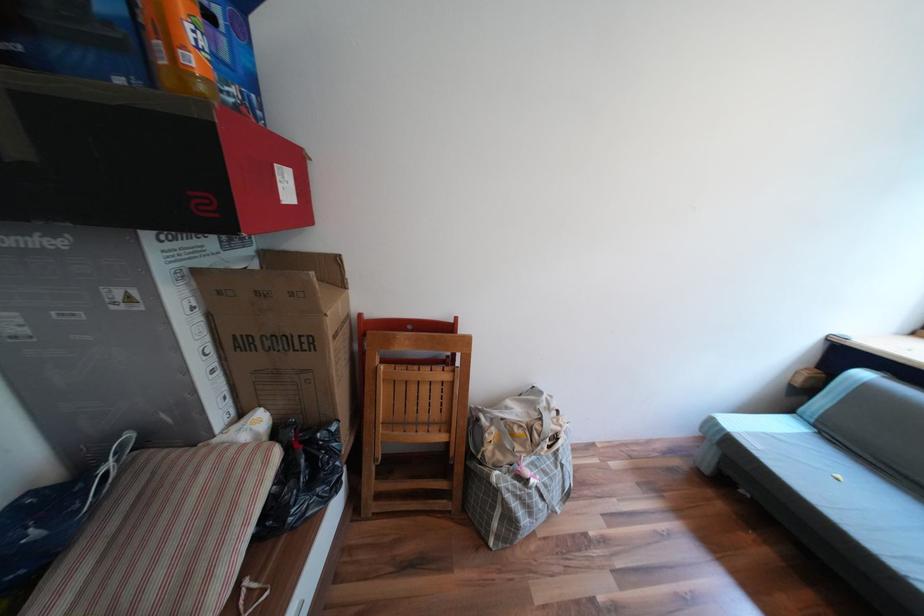
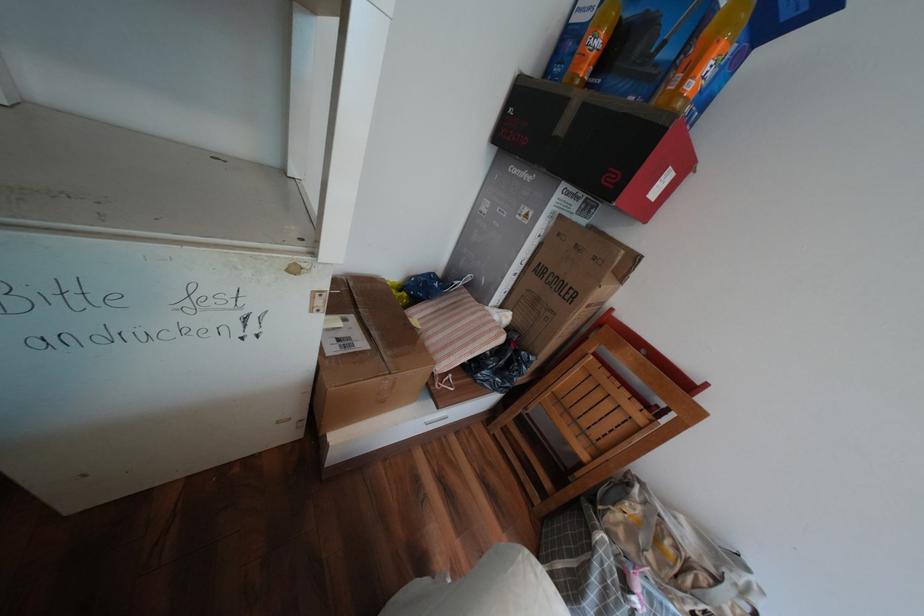
Question: How did the camera likely rotate?

Choices:
 (A) Left
 (B) Right
 (C) Up
 (D) Down

Answer: (A)